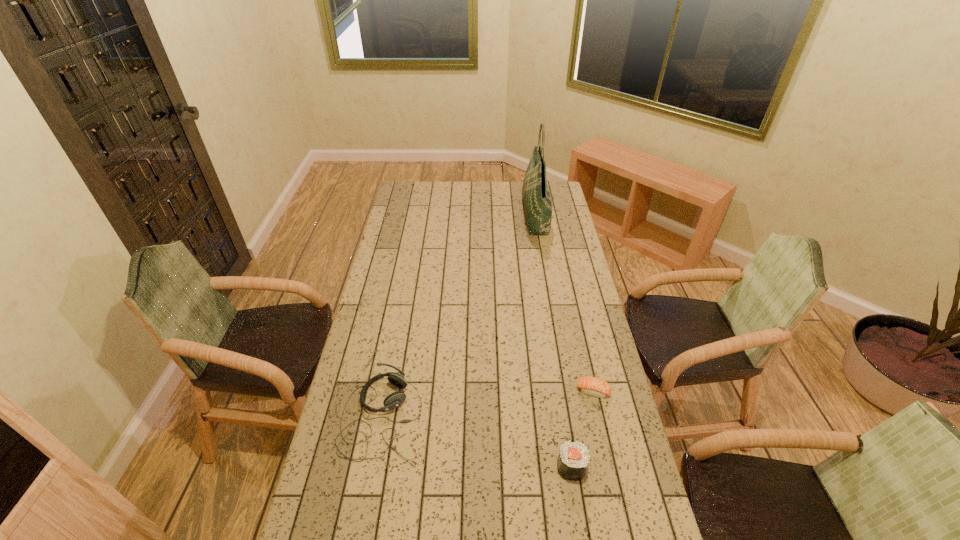
The width and height of the screenshot is (960, 540). Find the location of `the farthest object`. the farthest object is located at coordinates (536, 197).

Image resolution: width=960 pixels, height=540 pixels. What are the coordinates of `the tallest object` in the screenshot? It's located at (536, 197).

Identify the location of the taller sushi. (573, 459).

What are the coordinates of `the left sushi` in the screenshot? It's located at (573, 459).

Image resolution: width=960 pixels, height=540 pixels. Find the location of `the leftmost object`. the leftmost object is located at coordinates (395, 399).

This screenshot has height=540, width=960. What are the coordinates of `the farther sushi` in the screenshot? It's located at (592, 386).

This screenshot has width=960, height=540. I want to click on the right sushi, so click(x=592, y=386).

The image size is (960, 540). In order to click on vacant space located on the front of the farthest object in this screenshot , I will do `click(547, 285)`.

Locate an element on the screen. free location located on the back of the left sushi is located at coordinates (556, 369).

At what (x,y) coordinates should I click in order to perform the action: click on free space located 0.130m on the outer surface of the leftmost object. Please return your answer as a coordinate pair (x, y). Image resolution: width=960 pixels, height=540 pixels. Looking at the image, I should click on (465, 418).